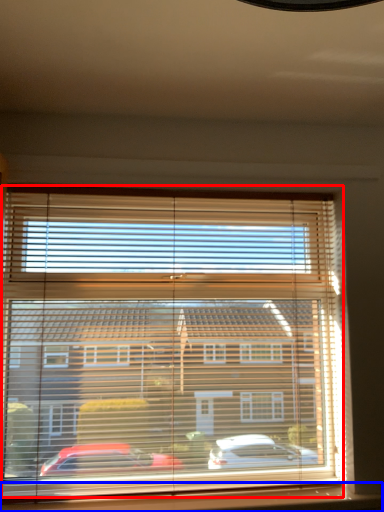
Question: Which point is closer to the camera, bay window (highlighted by a red box) or window sill (highlighted by a blue box)?

Choices:
 (A) bay window
 (B) window sill

Answer: (B)